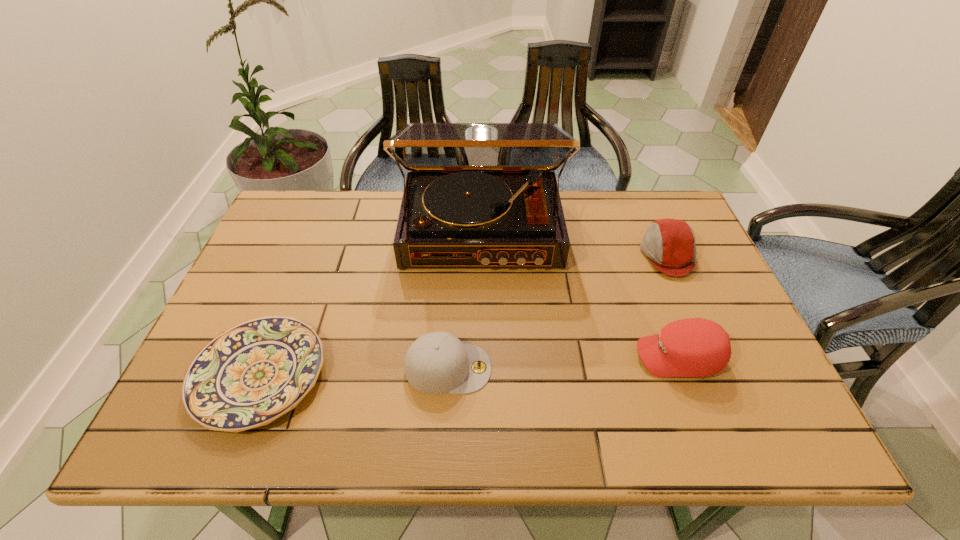
Locate an element on the screen. This screenshot has height=540, width=960. vacant space located 0.220m on the back of the plate is located at coordinates (305, 261).

You are a GUI agent. You are given a task and a screenshot of the screen. Output one action in this format:
    pyautogui.click(x=<x>, y=<y>)
    Task: Click on the record player that is at the far edge
    
    Given the screenshot: What is the action you would take?
    pyautogui.click(x=477, y=195)

Locate an element on the screen. Image resolution: width=960 pixels, height=540 pixels. cap that is at the far edge is located at coordinates (669, 244).

Locate an element on the screen. object that is at the near edge is located at coordinates (248, 376).

Where is `object present at the left edge`? The height and width of the screenshot is (540, 960). object present at the left edge is located at coordinates (248, 376).

At what (x,y) coordinates should I click in order to perform the action: click on object that is positioned at the near left corner. Please return your answer as a coordinate pair (x, y). The image size is (960, 540). Looking at the image, I should click on (248, 376).

In order to click on object that is at the far right corner in this screenshot , I will do coord(669,244).

This screenshot has height=540, width=960. What are the coordinates of `free space at the far edge of the desktop` in the screenshot? It's located at (601, 231).

Where is `vacant region at the near edge of the desktop`? vacant region at the near edge of the desktop is located at coordinates (451, 409).

At what (x,y) coordinates should I click in order to perform the action: click on free space at the left edge of the desktop. Please return your answer as a coordinate pair (x, y). The image size is (960, 540). Looking at the image, I should click on (263, 244).